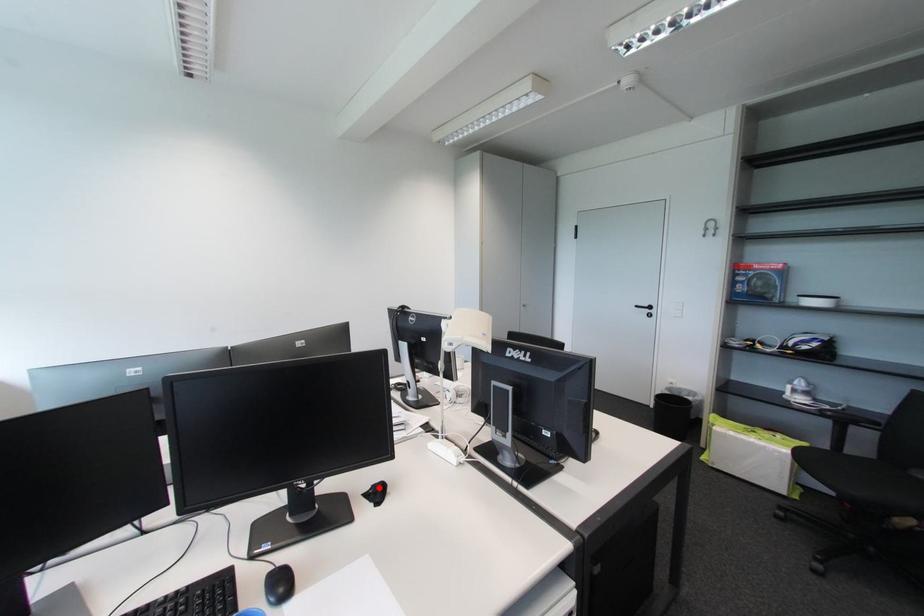
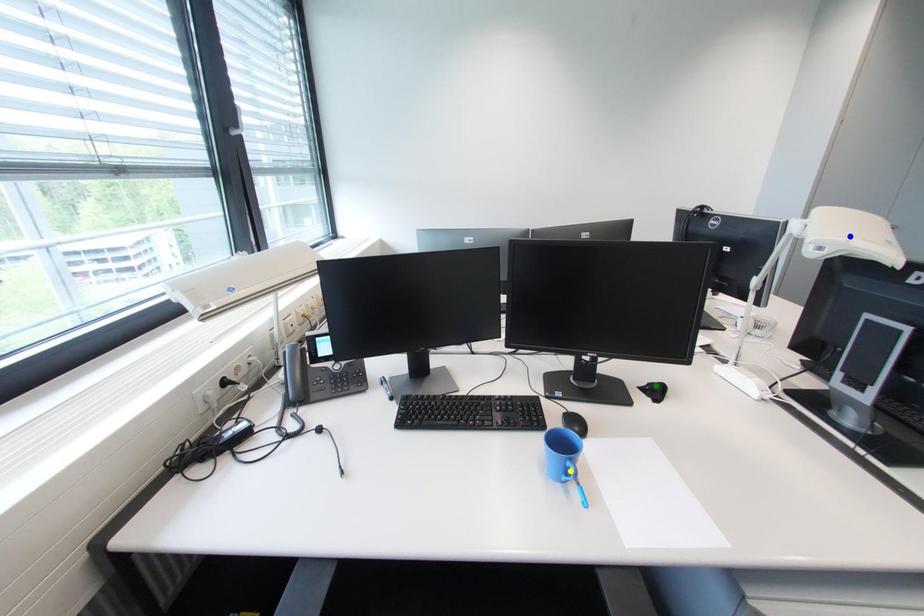
Question: I am providing you with two images of the same scene from different viewpoints. A red point is marked on the first image. You are given multiple points on the second image. Which spot in image 2 lines up with the point in image 1?

Choices:
 (A) green point
 (B) yellow point
 (C) blue point

Answer: (A)